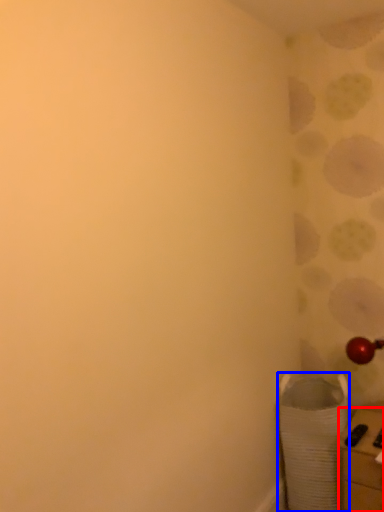
Question: Which object appears farthest to the camera in this image, furniture (highlighted by a red box) or laundry basket (highlighted by a blue box)?

Choices:
 (A) furniture
 (B) laundry basket

Answer: (B)